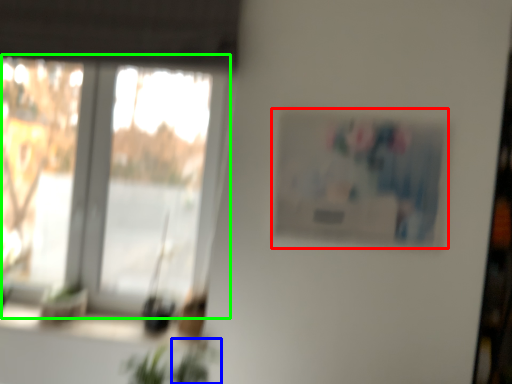
Question: Based on their relative distances, which object is farther from picture frame (highlighted by a red box)? Choose from plant (highlighted by a blue box) and window (highlighted by a green box).

Choices:
 (A) plant
 (B) window

Answer: (A)